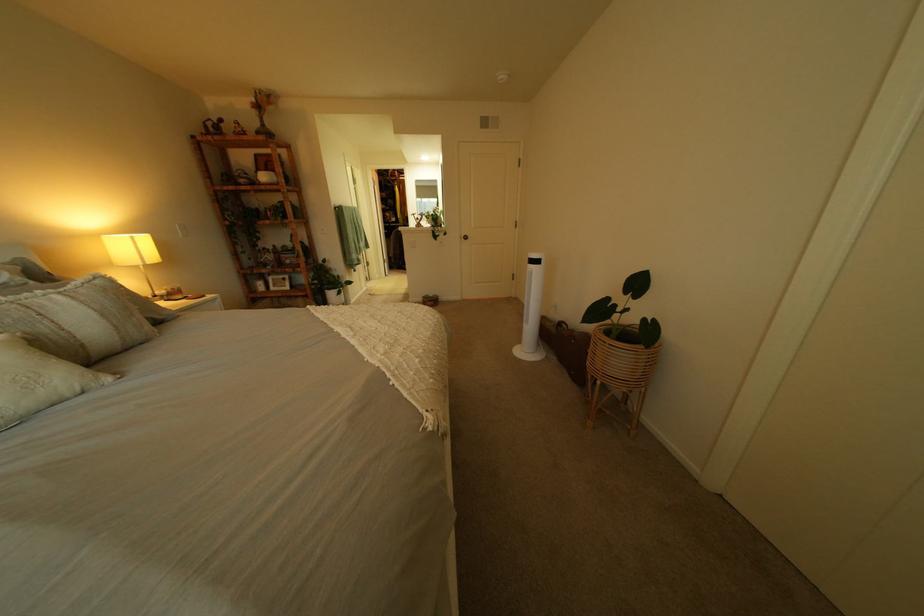
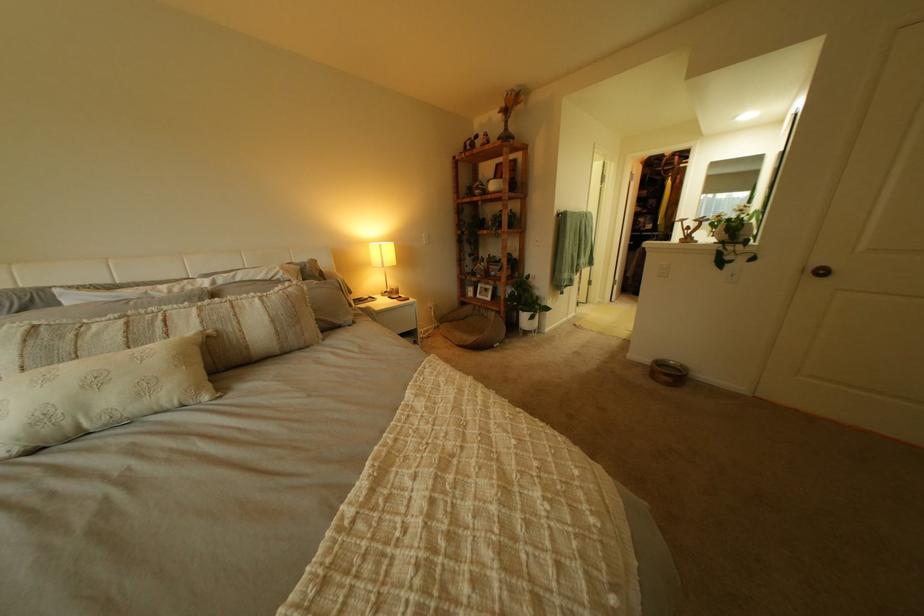
Locate, in the second image, the point that corresponds to point (112, 236) in the first image.

(381, 244)